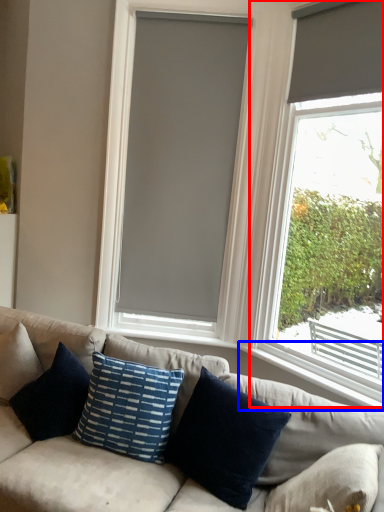
Question: Which of the following is the closest to the observer, window (highlighted by a red box) or window sill (highlighted by a blue box)?

Choices:
 (A) window
 (B) window sill

Answer: (A)